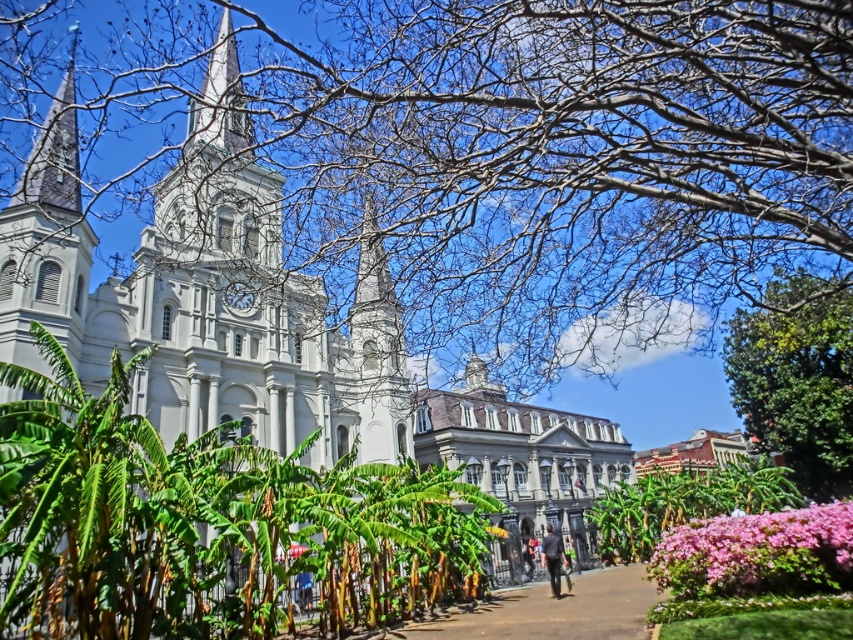
Does bare branches at upper center have a greater height compared to white stone building at center?

Indeed, bare branches at upper center has a greater height compared to white stone building at center.

Is bare branches at upper center below white stone building at center?

No, bare branches at upper center is not below white stone building at center.

Between point (584, 225) and point (538, 460), which one is positioned behind?

The point (538, 460) is more distant.

The image size is (853, 640). I want to click on bare branches at upper center, so click(561, 157).

Does green leafy tree at center have a lesser width compared to green leafy tree at lower right?

Incorrect, green leafy tree at center's width is not less than green leafy tree at lower right's.

Is point (459, 570) farther from viewer compared to point (677, 518)?

No, (459, 570) is closer to viewer.

Describe the element at coordinates (207, 524) in the screenshot. The image size is (853, 640). I see `green leafy tree at center` at that location.

This screenshot has height=640, width=853. Identify the location of green leafy tree at center. (207, 524).

Describe the element at coordinates (550, 611) in the screenshot. Image resolution: width=853 pixels, height=640 pixels. I see `brown paved path at center` at that location.

Measure the distance from brown paved path at center to green leafy tree at lower right.

30.82 meters

Is point (578, 634) more distant than point (645, 525)?

No, (578, 634) is closer to viewer.

I want to click on brown paved path at center, so click(x=550, y=611).